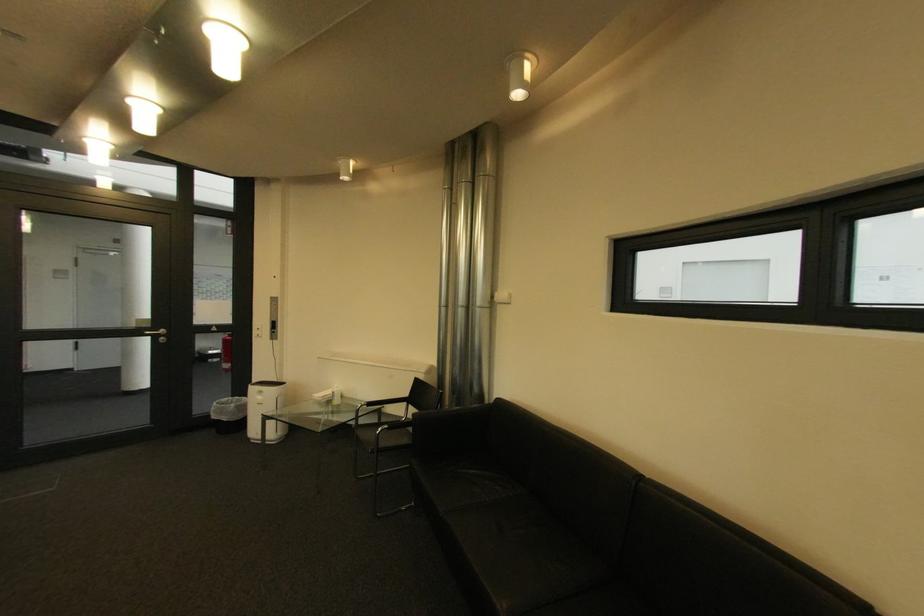
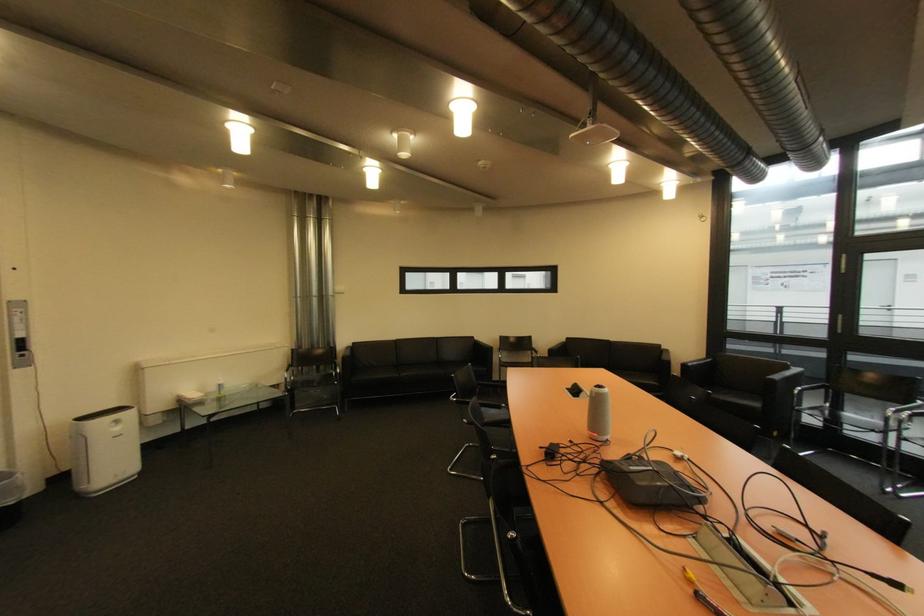
Locate, in the second image, the point that corresponds to the point at 424,381 in the first image.

(301, 352)